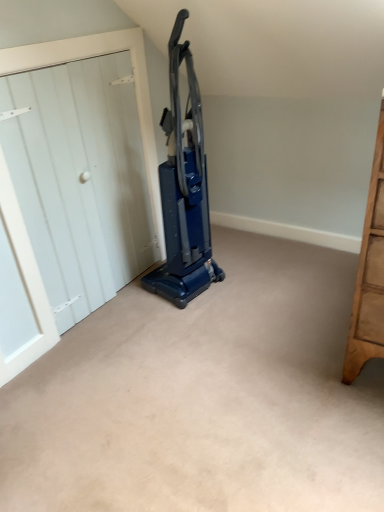
At what (x,y) coordinates should I click in order to perform the action: click on empty space that is ontop of white wood door at left (from a real-world perspective). Please return your answer as a coordinate pair (x, y). Looking at the image, I should click on (73, 33).